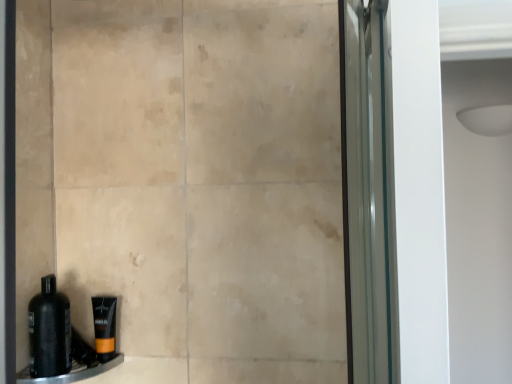
In order to face black plastic ledge at lower left, should I rotate leftwards or rightwards?

A 23.379 degree turn to the left will do.

This screenshot has width=512, height=384. In order to click on black matte bottle at lower left in this screenshot , I will do `click(49, 331)`.

Would you consider black matte bottle at lower left to be distant from black plastic ledge at lower left?

No, there isn't a large distance between black matte bottle at lower left and black plastic ledge at lower left.

From a real-world perspective, does black matte bottle at lower left stand above black plastic ledge at lower left?

Yes, from a real-world perspective, black matte bottle at lower left is above black plastic ledge at lower left.

Based on the photo, is black matte bottle at lower left aimed at black plastic ledge at lower left?

No, black matte bottle at lower left is not aimed at black plastic ledge at lower left.

What's the angular difference between black matte bottle at lower left and black plastic ledge at lower left's facing directions?

They differ by 29.6 degrees in their facing directions.

Is orange matte tube at lower left surrounding black matte bottle at lower left?

No, black matte bottle at lower left is not inside orange matte tube at lower left.

Looking at this image, is orange matte tube at lower left thinner than black matte bottle at lower left?

Correct, the width of orange matte tube at lower left is less than that of black matte bottle at lower left.

Image resolution: width=512 pixels, height=384 pixels. What are the coordinates of `bottle lying above the orange matte tube at lower left (from the image's perspective)` in the screenshot? It's located at (49, 331).

Are orange matte tube at lower left and black matte bottle at lower left far apart?

No, orange matte tube at lower left is not far away from black matte bottle at lower left.

From their relative heights in the image, would you say black plastic ledge at lower left is taller or shorter than orange matte tube at lower left?

Clearly, black plastic ledge at lower left is shorter compared to orange matte tube at lower left.

Where is `toiletry that is on the right side of black plastic ledge at lower left`? toiletry that is on the right side of black plastic ledge at lower left is located at coordinates (105, 326).

Is black plastic ledge at lower left oriented towards orange matte tube at lower left?

No, black plastic ledge at lower left does not turn towards orange matte tube at lower left.

Is black matte bottle at lower left surrounding orange matte tube at lower left?

No, orange matte tube at lower left is not inside black matte bottle at lower left.

From a real-world perspective, does black matte bottle at lower left sit lower than orange matte tube at lower left?

Actually, black matte bottle at lower left is physically above orange matte tube at lower left in the real world.

Can you confirm if black matte bottle at lower left is smaller than orange matte tube at lower left?

Actually, black matte bottle at lower left might be larger than orange matte tube at lower left.

Can you tell me how much black matte bottle at lower left and orange matte tube at lower left differ in facing direction?

The angular difference between black matte bottle at lower left and orange matte tube at lower left is 76 degrees.

Can you confirm if orange matte tube at lower left is thinner than black plastic ledge at lower left?

Indeed, orange matte tube at lower left has a lesser width compared to black plastic ledge at lower left.

Consider the image. From a real-world perspective, which is physically below, orange matte tube at lower left or black plastic ledge at lower left?

black plastic ledge at lower left, from a real-world perspective.

Is orange matte tube at lower left bigger or smaller than black plastic ledge at lower left?

orange matte tube at lower left is smaller than black plastic ledge at lower left.

In the scene shown: How different are the orientations of orange matte tube at lower left and black plastic ledge at lower left in degrees?

The angle between the facing direction of orange matte tube at lower left and the facing direction of black plastic ledge at lower left is 106 degrees.

Consider the image. Do you think black plastic ledge at lower left is within black matte bottle at lower left, or outside of it?

black plastic ledge at lower left is not inside black matte bottle at lower left, it's outside.

Based on the photo, which is closer, (98, 366) or (40, 363)?

The point (40, 363) is more forward.

Which is more to the right, black plastic ledge at lower left or black matte bottle at lower left?

black plastic ledge at lower left is more to the right.

From a real-world perspective, is black plastic ledge at lower left above or below black matte bottle at lower left?

black plastic ledge at lower left is situated lower than black matte bottle at lower left in the real world.

The height and width of the screenshot is (384, 512). Find the location of `ledge lying on the right of black matte bottle at lower left`. ledge lying on the right of black matte bottle at lower left is located at coordinates (72, 372).

Identify the location of toiletry that appears behind the black matte bottle at lower left. (105, 326).

Considering their positions, is black plastic ledge at lower left positioned closer to orange matte tube at lower left than black matte bottle at lower left?

Among the two, black plastic ledge at lower left is located nearer to orange matte tube at lower left.

In the scene shown: From the image, which object appears to be farther from black matte bottle at lower left, orange matte tube at lower left or black plastic ledge at lower left?

Among the two, orange matte tube at lower left is located further to black matte bottle at lower left.

Based on their spatial positions, is black matte bottle at lower left or orange matte tube at lower left further from black plastic ledge at lower left?

black matte bottle at lower left lies further to black plastic ledge at lower left than the other object.

Based on their spatial positions, is black matte bottle at lower left or black plastic ledge at lower left further from orange matte tube at lower left?

black matte bottle at lower left is further to orange matte tube at lower left.

Estimate the real-world distances between objects in this image. Which object is closer to black plastic ledge at lower left, orange matte tube at lower left or black matte bottle at lower left?

orange matte tube at lower left is closer to black plastic ledge at lower left.

Looking at the image, which one is located closer to black matte bottle at lower left, black plastic ledge at lower left or orange matte tube at lower left?

black plastic ledge at lower left.

Identify the location of toiletry between black matte bottle at lower left and black plastic ledge at lower left vertically. The width and height of the screenshot is (512, 384). (105, 326).